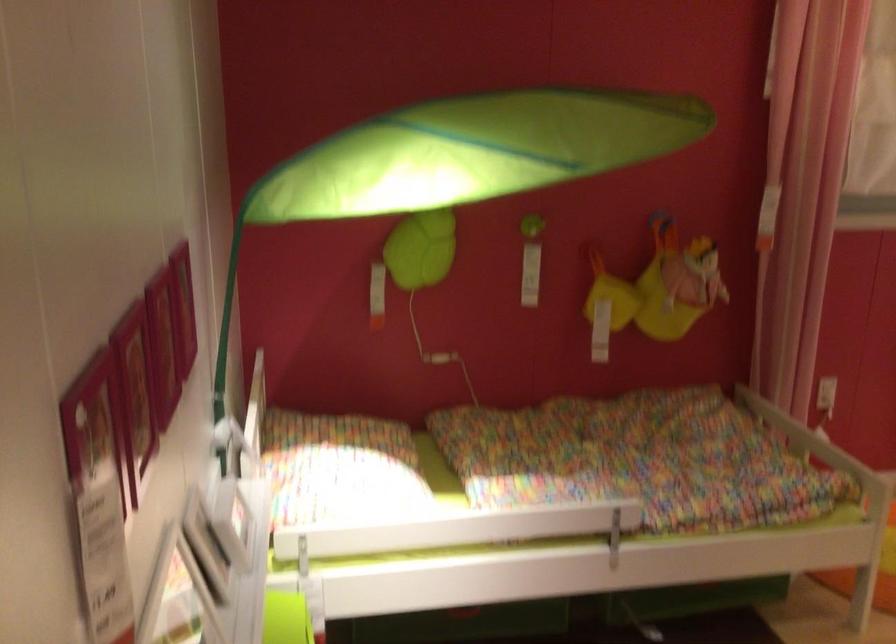
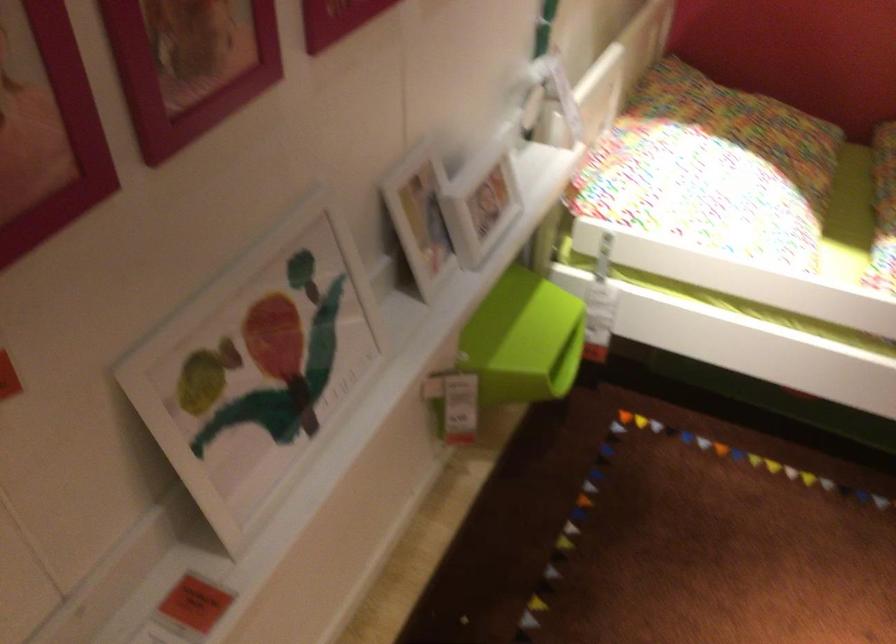
In the second image, find the point that corresponds to (237,529) in the first image.

(479, 200)